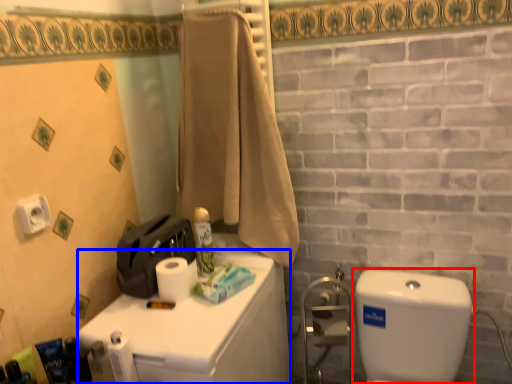
Question: Which object appears farthest to the camera in this image, water tank (highlighted by a red box) or counter top (highlighted by a blue box)?

Choices:
 (A) water tank
 (B) counter top

Answer: (B)